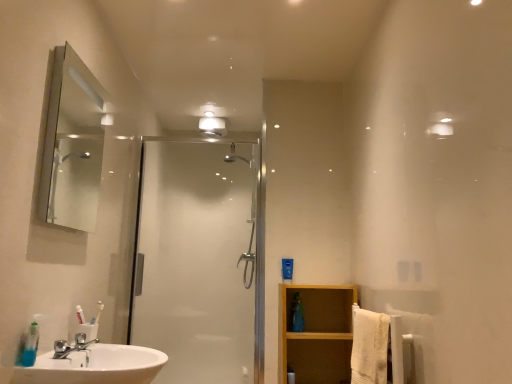
Question: From a real-world perspective, is matte silver mirror at upper left beneath clear glass shower door at center?

Choices:
 (A) no
 (B) yes

Answer: (A)

Question: Are matte silver mirror at upper left and clear glass shower door at center located far from each other?

Choices:
 (A) no
 (B) yes

Answer: (A)

Question: Considering the relative sizes of matte silver mirror at upper left and clear glass shower door at center in the image provided, is matte silver mirror at upper left smaller than clear glass shower door at center?

Choices:
 (A) no
 (B) yes

Answer: (B)

Question: Is clear glass shower door at center completely or partially inside matte silver mirror at upper left?

Choices:
 (A) yes
 (B) no

Answer: (B)

Question: Could you tell me if matte silver mirror at upper left is turned towards clear glass shower door at center?

Choices:
 (A) yes
 (B) no

Answer: (B)

Question: Is point (310, 337) closer or farther from the camera than point (242, 334)?

Choices:
 (A) farther
 (B) closer

Answer: (B)

Question: Looking at the image, does wooden shelf at lower right seem bigger or smaller compared to clear glass shower door at center?

Choices:
 (A) small
 (B) big

Answer: (A)

Question: From a real-world perspective, is wooden shelf at lower right positioned above or below clear glass shower door at center?

Choices:
 (A) above
 (B) below

Answer: (B)

Question: From the image's perspective, is wooden shelf at lower right above or below clear glass shower door at center?

Choices:
 (A) below
 (B) above

Answer: (A)

Question: Looking at their shapes, would you say matte silver mirror at upper left is wider or thinner than white glossy light fixture at upper center?

Choices:
 (A) wide
 (B) thin

Answer: (B)

Question: Does point (84, 218) appear closer or farther from the camera than point (210, 122)?

Choices:
 (A) closer
 (B) farther

Answer: (B)

Question: Is matte silver mirror at upper left spatially inside white glossy light fixture at upper center, or outside of it?

Choices:
 (A) inside
 (B) outside

Answer: (B)

Question: Based on their positions, is matte silver mirror at upper left located to the left or right of white glossy light fixture at upper center?

Choices:
 (A) left
 (B) right

Answer: (A)

Question: Is white glossy light fixture at upper center bigger or smaller than wooden shelf at lower right?

Choices:
 (A) small
 (B) big

Answer: (A)

Question: In terms of height, does white glossy light fixture at upper center look taller or shorter compared to wooden shelf at lower right?

Choices:
 (A) short
 (B) tall

Answer: (A)